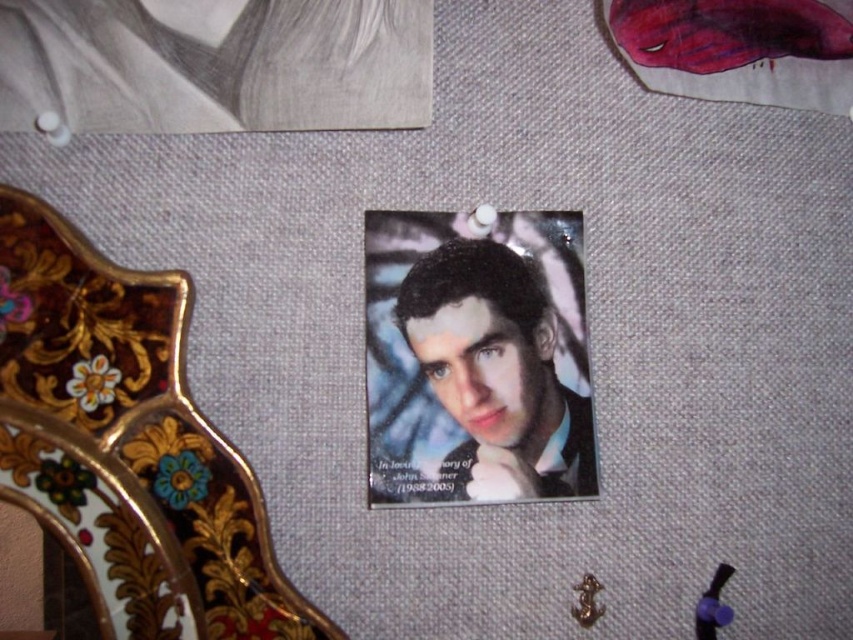
You are an interior designer planning to hang two items on a wall. The gold painted wood at center and the matte black portrait at center need to be spaced exactly 30 centimeters apart. Based on the scene, will their current placement meet this requirement?

The gold painted wood at center and matte black portrait at center are currently 29.05 centimeters apart, which is slightly less than the required 30 centimeters. Therefore, their current placement does not meet the requirement.

In the scene shown: You are standing in front of a memorial board and see the gold painted wood at center and the matte black portrait at center. Which object is positioned to the left of the other?

The gold painted wood at center is to the left of the matte black portrait at center.

You are an interior designer planning to add a new decorative item to the bulletin board. You have a small silver vase that is 10 cm wide. The space between the gold painted wood at center and the matte black portrait at center is 2 cm. Can you place the vase between them without overlapping?

The space between the gold painted wood at center and the matte black portrait at center is 2 cm. Since the vase is 10 cm wide, it would not fit in the 2 cm space between them, so you cannot place the vase there without overlapping.